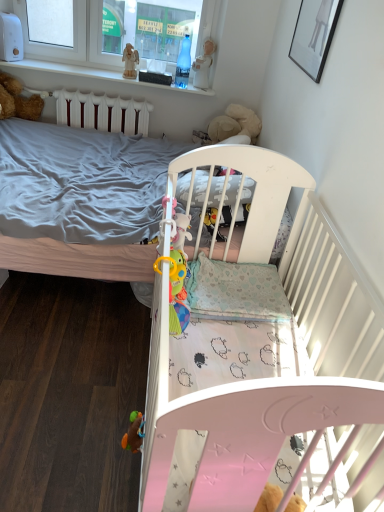
Question: From a real-world perspective, is wooden angel at upper center positioned under white plastic statue at upper center, which appears as the 2th toy when viewed from the left, based on gravity?

Choices:
 (A) no
 (B) yes

Answer: (B)

Question: Does wooden angel at upper center have a lesser width compared to white plastic statue at upper center, which is the 1th toy in top-to-bottom order?

Choices:
 (A) yes
 (B) no

Answer: (A)

Question: Is wooden angel at upper center turned away from white plastic statue at upper center, which is the 1th toy from back to front?

Choices:
 (A) yes
 (B) no

Answer: (B)

Question: Can you confirm if wooden angel at upper center is positioned to the right of white plastic statue at upper center, which is the 1th toy in top-to-bottom order?

Choices:
 (A) no
 (B) yes

Answer: (A)

Question: From a real-world perspective, is wooden angel at upper center over white plastic statue at upper center, which is the second toy from bottom to top?

Choices:
 (A) yes
 (B) no

Answer: (B)

Question: Is wooden angel at upper center beside white plastic statue at upper center, which is the second toy from front to back?

Choices:
 (A) no
 (B) yes

Answer: (A)

Question: From a real-world perspective, is wooden angel at upper center on white plastic window frame at upper left?

Choices:
 (A) yes
 (B) no

Answer: (B)

Question: Can you confirm if wooden angel at upper center is thinner than white plastic window frame at upper left?

Choices:
 (A) no
 (B) yes

Answer: (B)

Question: Does wooden angel at upper center have a smaller size compared to white plastic window frame at upper left?

Choices:
 (A) yes
 (B) no

Answer: (A)

Question: Is white plastic window frame at upper left at the back of wooden angel at upper center?

Choices:
 (A) yes
 (B) no

Answer: (A)

Question: Does wooden angel at upper center appear on the left side of white plastic window frame at upper left?

Choices:
 (A) yes
 (B) no

Answer: (B)

Question: Considering the relative sizes of wooden angel at upper center and white plastic window frame at upper left in the image provided, is wooden angel at upper center wider than white plastic window frame at upper left?

Choices:
 (A) no
 (B) yes

Answer: (A)

Question: Can you see white plastic statue at upper center, which is the second toy from front to back, touching white plastic window frame at upper left?

Choices:
 (A) yes
 (B) no

Answer: (B)